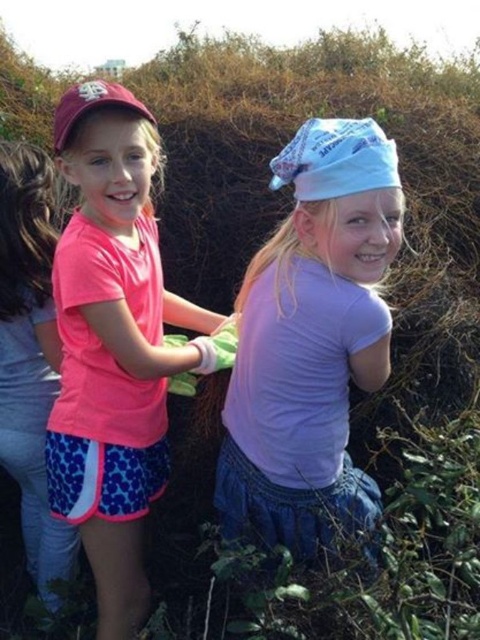
Is point (336, 193) more distant than point (119, 438)?

That is False.

Between light blue fabric bandana at center and pink matte shirt at left, which one has more height?

pink matte shirt at left is taller.

Is point (301, 358) more distant than point (137, 604)?

That is False.

This screenshot has width=480, height=640. In order to click on light blue fabric bandana at center in this screenshot , I will do click(x=311, y=340).